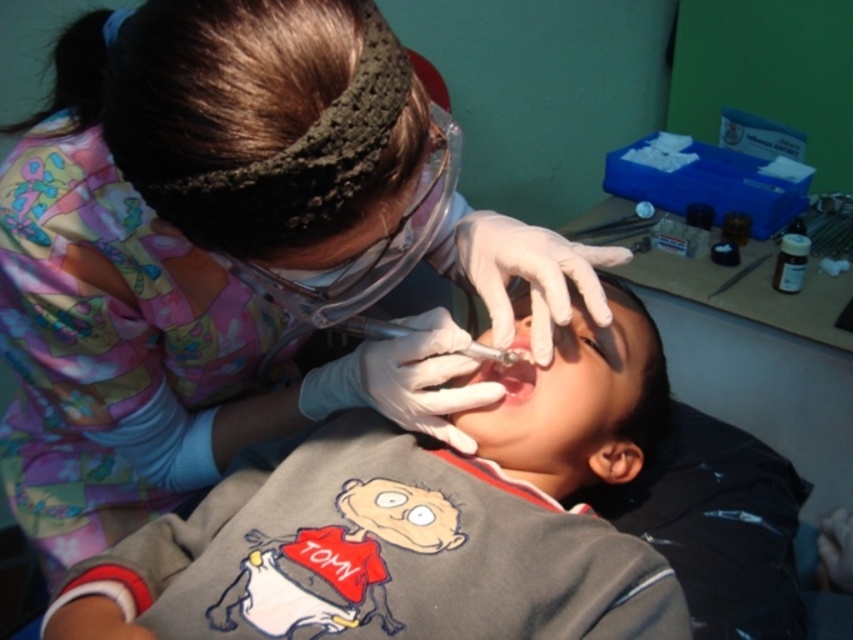
Question: Is matte white shirt at center positioned before gray cotton shirt at center?

Choices:
 (A) no
 (B) yes

Answer: (B)

Question: Is gray cotton shirt at center to the left of pink glossy lips at center from the viewer's perspective?

Choices:
 (A) yes
 (B) no

Answer: (A)

Question: Among these objects, which one is nearest to the camera?

Choices:
 (A) matte skin nose at center
 (B) matte white shirt at center

Answer: (B)

Question: Which point is closer to the camera?

Choices:
 (A) (19, 460)
 (B) (332, 586)

Answer: (B)

Question: Does matte white shirt at center have a larger size compared to metallic needle at center?

Choices:
 (A) yes
 (B) no

Answer: (A)

Question: Which point appears farthest from the camera in this image?

Choices:
 (A) (498, 365)
 (B) (372, 337)
 (C) (521, 321)

Answer: (C)